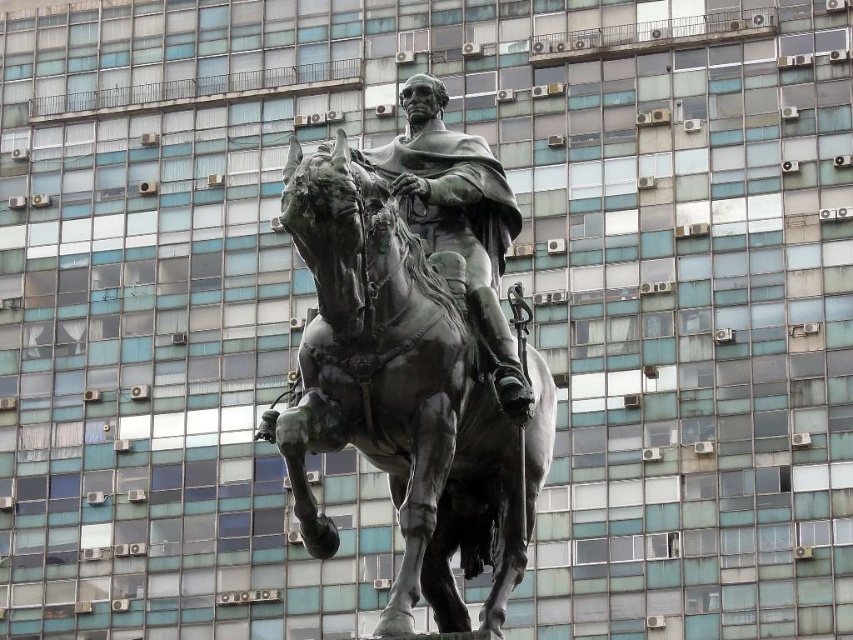
Who is shorter, bronze/golden horse at center or shiny bronze statue at center?

With less height is shiny bronze statue at center.

Is the position of bronze/golden horse at center less distant than that of shiny bronze statue at center?

Yes, it is.

Who is more distant from viewer, (x=508, y=563) or (x=456, y=216)?

The point (x=456, y=216) is behind.

You are a GUI agent. You are given a task and a screenshot of the screen. Output one action in this format:
    pyautogui.click(x=<x>, y=<y>)
    Task: Click on the bronze/golden horse at center
    Image resolution: width=853 pixels, height=640 pixels.
    Given the screenshot: What is the action you would take?
    pyautogui.click(x=404, y=396)